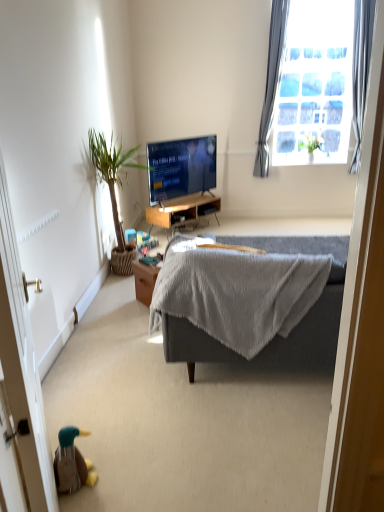
Question: Is gray fabric couch at center bigger or smaller than brown wooden screen door at lower left?

Choices:
 (A) big
 (B) small

Answer: (A)

Question: Considering their positions, is gray fabric couch at center located in front of or behind brown wooden screen door at lower left?

Choices:
 (A) front
 (B) behind

Answer: (B)

Question: Which is nearer to the green leafy plant at upper right, which is the second houseplant from front to back?

Choices:
 (A) wooden desk at center
 (B) brown wooden screen door at lower left
 (C) gray fabric couch at center
 (D) gray fabric curtain at upper right, the 2th curtain from the left
 (E) green leafy plant at left, arranged as the second houseplant when viewed from the back

Answer: (D)

Question: Which is farther from the wooden desk at center?

Choices:
 (A) green leafy plant at left, placed as the first houseplant when sorted from front to back
 (B) gray fabric curtain at upper right, the first curtain when ordered from right to left
 (C) satin gray curtain at upper right, the 2th curtain when ordered from right to left
 (D) matte black tv at center
 (E) gray fabric couch at center

Answer: (B)